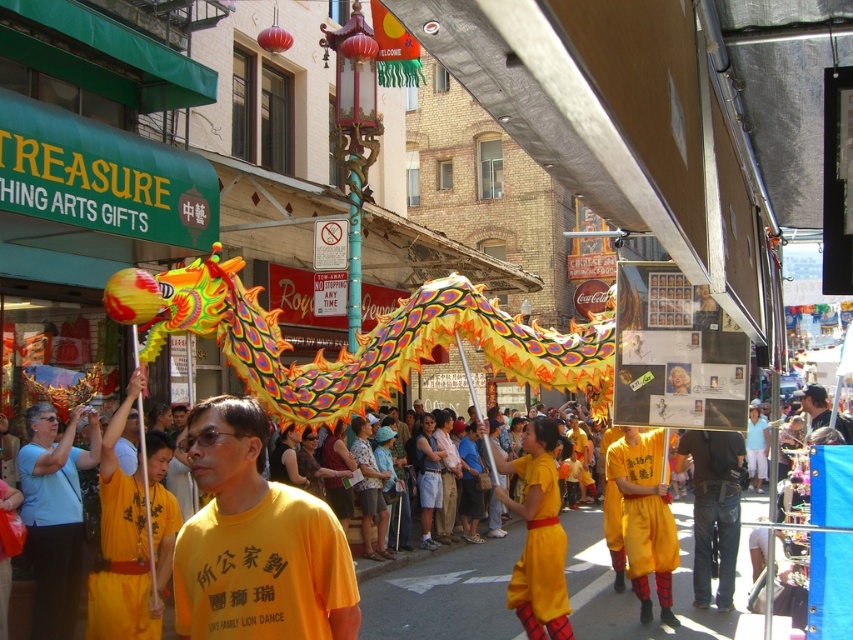
Question: Can you confirm if yellow fabric dragon at center is smaller than yellow cotton shirt at center?

Choices:
 (A) yes
 (B) no

Answer: (B)

Question: Can you confirm if denim jeans at lower right is positioned below yellow cotton shirt at center?

Choices:
 (A) no
 (B) yes

Answer: (B)

Question: Which point is closer to the camera?

Choices:
 (A) yellow matte shirt at center
 (B) yellow matte shorts at center
 (C) yellow fabric dragon at center

Answer: (A)

Question: Which object is the farthest from the yellow cotton shirt at center?

Choices:
 (A) yellow fabric dragon at center
 (B) denim jeans at lower right

Answer: (B)

Question: Is yellow fabric dragon at center wider than yellow cotton shirt at center?

Choices:
 (A) no
 (B) yes

Answer: (B)

Question: Which of the following is the closest to the observer?

Choices:
 (A) yellow cotton shirt at center
 (B) yellow matte shorts at center

Answer: (B)